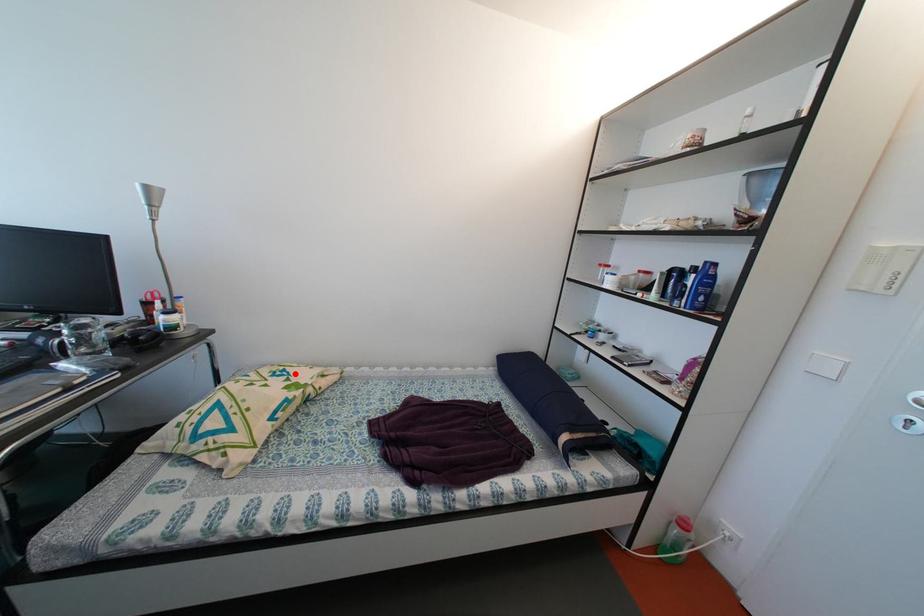
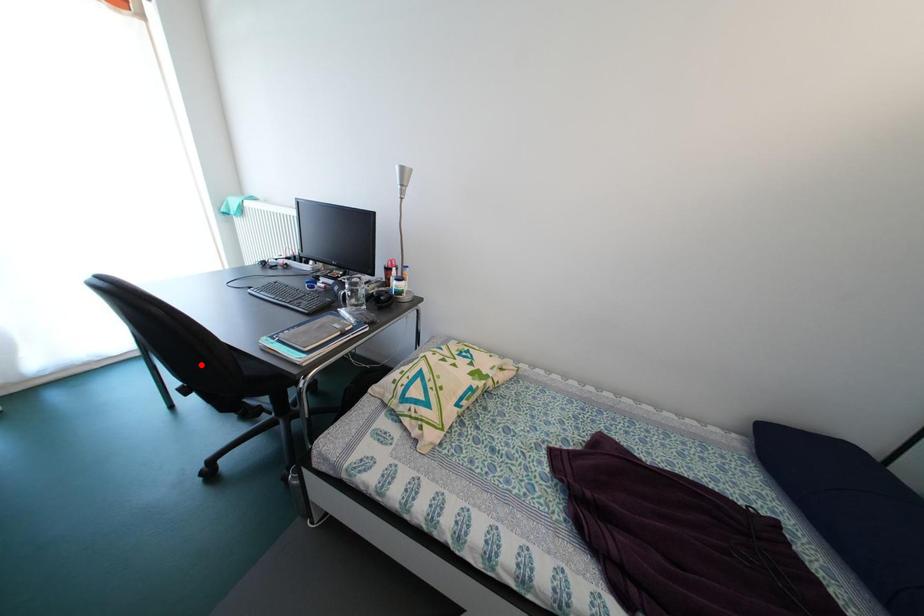
I am providing you with two images of the same scene from different viewpoints. A red point is marked on the first image and another point is marked on the second image. Does the point marked in image1 correspond to the same location as the one in image2?

No